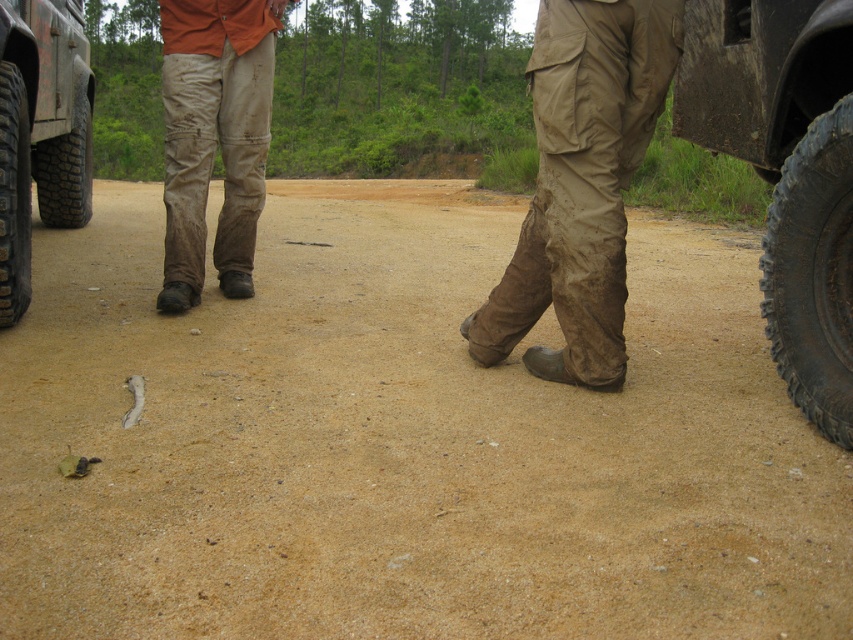
You are planning to cross a muddy trail with your vehicle. You see the rubber tread tire at right and the worn canvas pants at center in the scene. Which object indicates the trail might be slippery?

The rubber tread tire at right indicates the trail might be slippery because tires with deep treads are often used for better traction on slippery surfaces.

You are a hiker who needs to identify landmarks. You see a point marked at coordinates (581, 182) in the image. What object is located at that point?

The point at coordinates (581, 182) marks worn canvas pants at center.